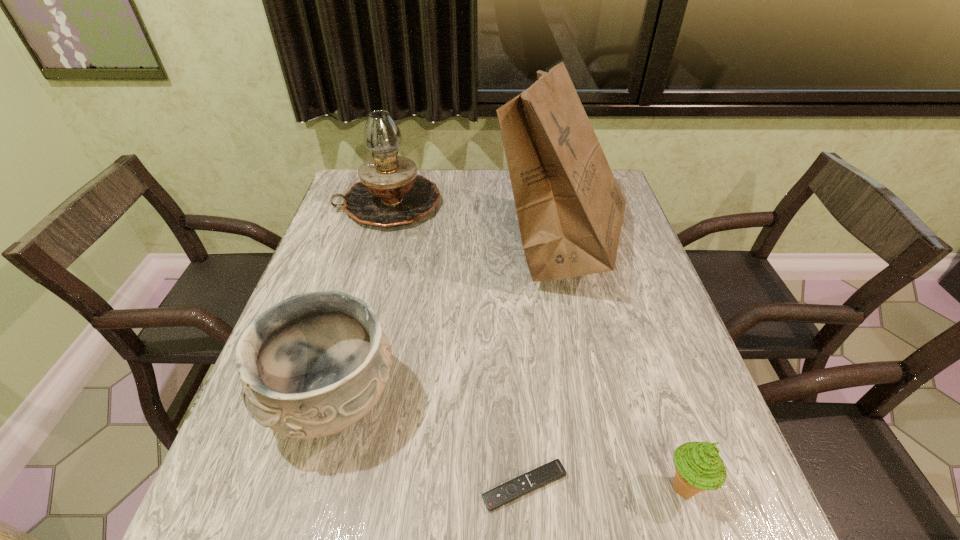
Find the location of a particular element. This screenshot has width=960, height=540. grocery bag is located at coordinates (570, 210).

Locate an element on the screen. The height and width of the screenshot is (540, 960). oil lamp is located at coordinates (390, 193).

At what (x,y) coordinates should I click in order to perform the action: click on the third shortest object. Please return your answer as a coordinate pair (x, y). The width and height of the screenshot is (960, 540). Looking at the image, I should click on (313, 365).

At what (x,y) coordinates should I click in order to perform the action: click on icecream. Please return your answer as a coordinate pair (x, y). Looking at the image, I should click on (698, 466).

The width and height of the screenshot is (960, 540). What are the coordinates of `remote control` in the screenshot? It's located at (554, 470).

Find the location of a particular element. The width and height of the screenshot is (960, 540). vacant space located 0.200m on the back of the tallest object is located at coordinates (543, 170).

Locate an element on the screen. The width and height of the screenshot is (960, 540). vacant space located 0.160m on the front of the second tallest object is located at coordinates (371, 271).

Where is `vacant space located 0.240m on the right of the third tallest object`? The image size is (960, 540). vacant space located 0.240m on the right of the third tallest object is located at coordinates 519,401.

Identify the location of blank space located 0.360m on the back of the fourth tallest object. The width and height of the screenshot is (960, 540). (627, 314).

The image size is (960, 540). I want to click on vacant space located on the right of the shortest object, so click(x=620, y=486).